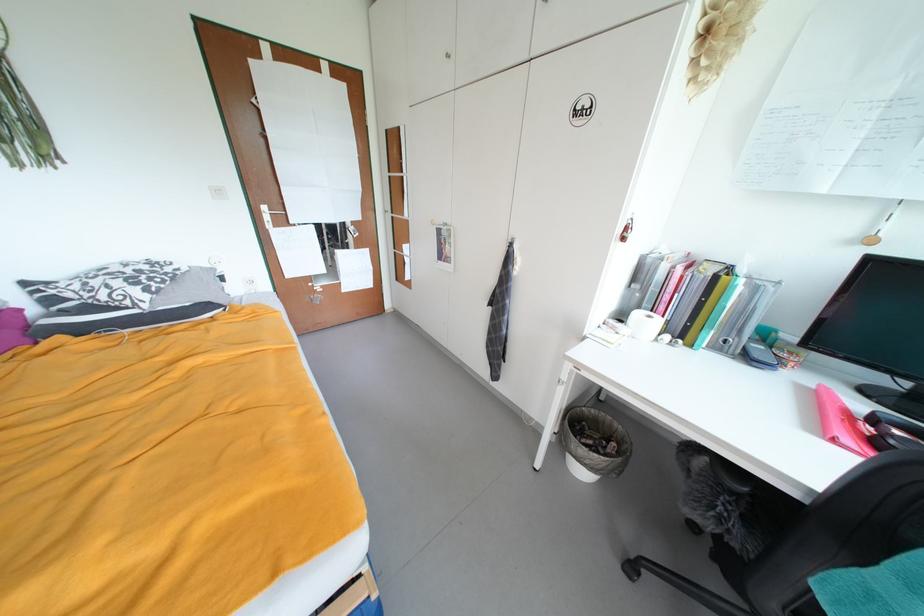
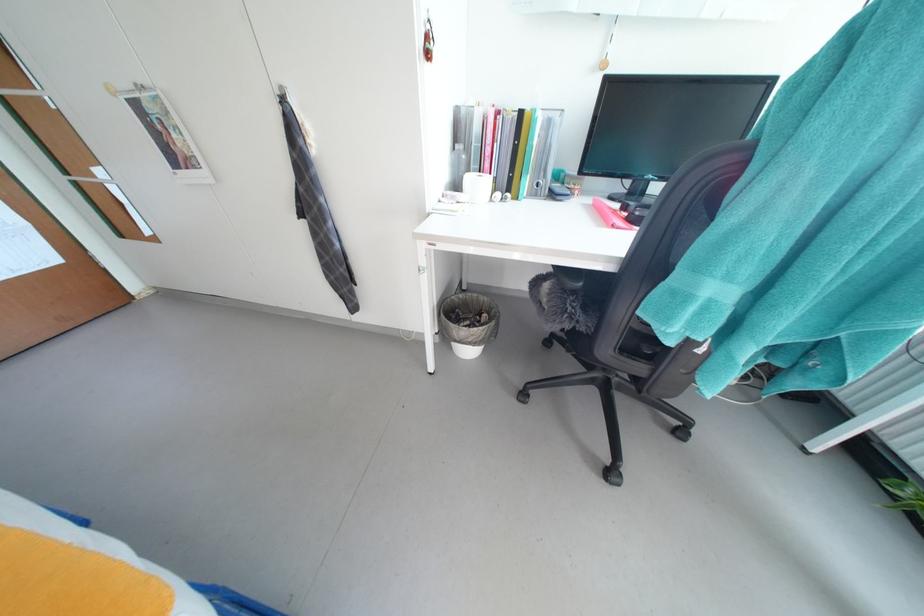
In the second image, find the point that corresponds to (x=821, y=389) in the first image.

(599, 204)